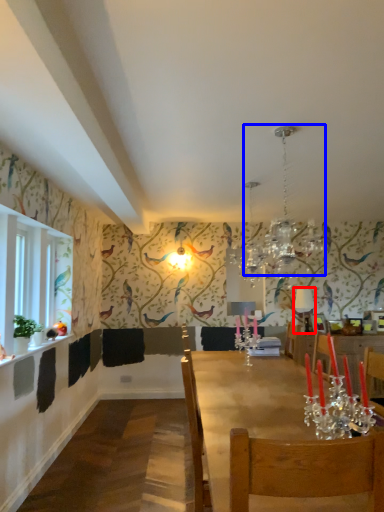
Question: Which object is further to the camera taking this photo, lamp (highlighted by a red box) or light fixture (highlighted by a blue box)?

Choices:
 (A) lamp
 (B) light fixture

Answer: (A)